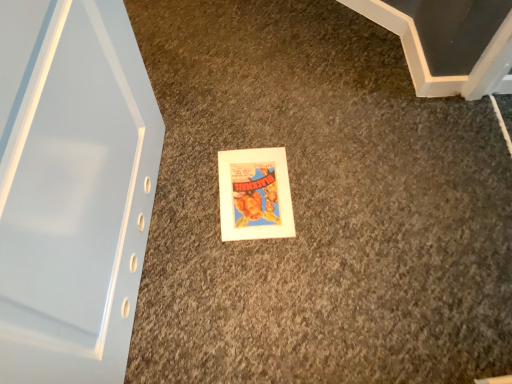
Find the location of `vacant area situated below white glossy door at left (from a real-world perspective)`. vacant area situated below white glossy door at left (from a real-world perspective) is located at coordinates (150, 246).